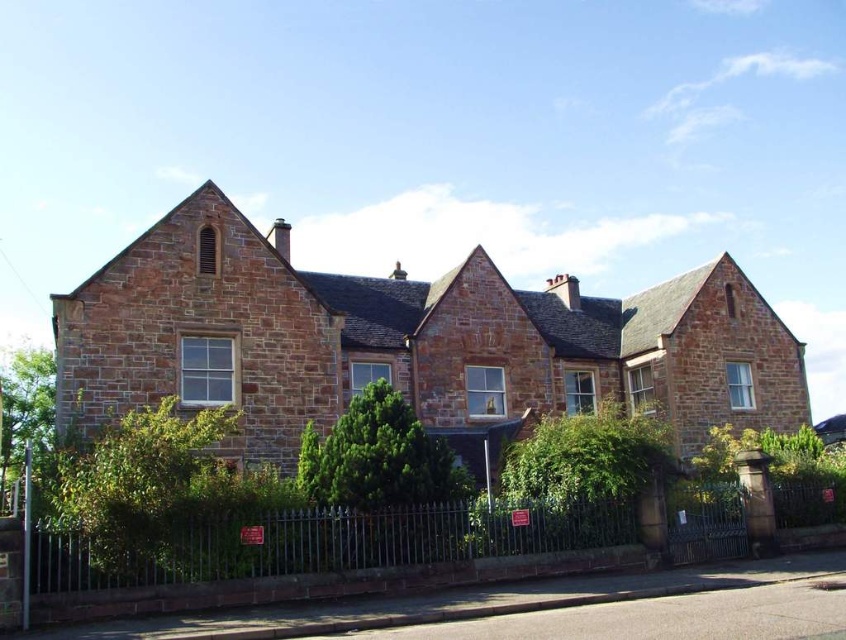
Question: Which point appears farthest from the camera in this image?

Choices:
 (A) (212, 452)
 (B) (520, 465)
 (C) (286, 600)
 (D) (441, 518)

Answer: (A)

Question: Does green wrought iron fence at lower center have a greater width compared to green leafy hedge at lower right?

Choices:
 (A) yes
 (B) no

Answer: (A)

Question: Can you confirm if green wrought iron fence at lower center is positioned to the right of green leafy hedge at center?

Choices:
 (A) no
 (B) yes

Answer: (B)

Question: Which of the following is the farthest from the observer?

Choices:
 (A) (404, 538)
 (B) (553, 467)

Answer: (B)

Question: Based on their relative distances, which object is farther from the green wrought iron fence at lower center?

Choices:
 (A) green leafy hedge at lower left
 (B) green leafy hedge at lower right
 (C) green leafy hedge at center

Answer: (A)

Question: Can you confirm if green leafy hedge at lower left is bigger than green leafy hedge at lower right?

Choices:
 (A) no
 (B) yes

Answer: (A)